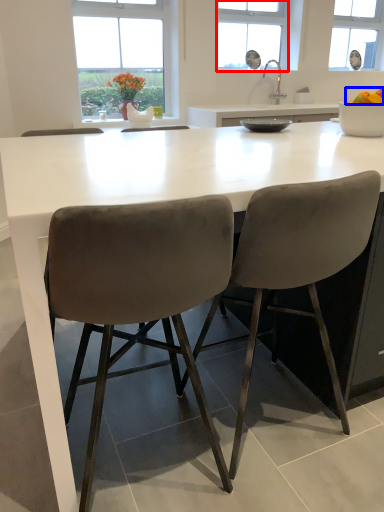
Question: Which object appears farthest to the camera in this image, window (highlighted by a red box) or food (highlighted by a blue box)?

Choices:
 (A) window
 (B) food

Answer: (A)